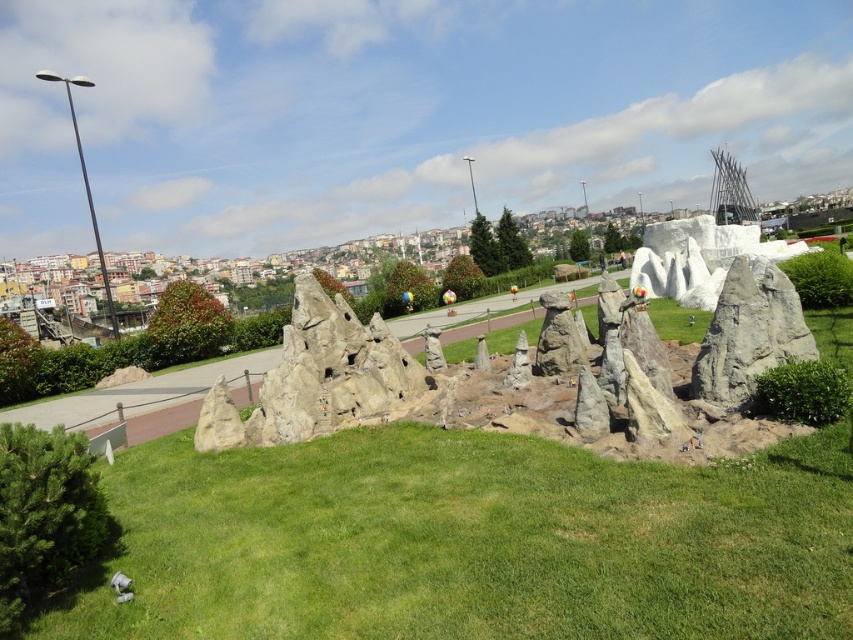
Can you confirm if rough stone rock formation at center is bigger than gray stone rock formation at center-right?

Indeed, rough stone rock formation at center has a larger size compared to gray stone rock formation at center-right.

Describe the element at coordinates (379, 397) in the screenshot. I see `rough stone rock formation at center` at that location.

You are a GUI agent. You are given a task and a screenshot of the screen. Output one action in this format:
    pyautogui.click(x=<x>, y=<y>)
    Task: Click on the rough stone rock formation at center
    The image size is (853, 640).
    Given the screenshot: What is the action you would take?
    pyautogui.click(x=379, y=397)